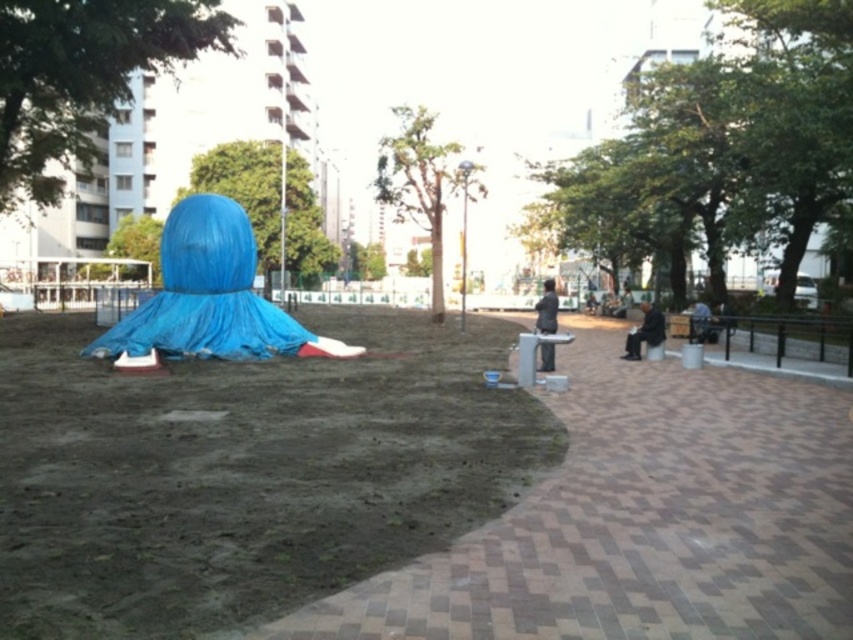
You are standing at the center of the park and want to reach the dirt field at left. Which direction should you move in?

The dirt field at left is located at point 0.736 on the x axis and 0.287 on the y axis. Since you are at the center, you should move towards the left direction to reach the dirt field at left.

You are standing at the origin point of a coordinate system placed at the bottom left corner of the image. You want to locate the blue tarpaulin sculpture at center. What are its coordinates?

The coordinates of the blue tarpaulin sculpture at center are at point (210,296).